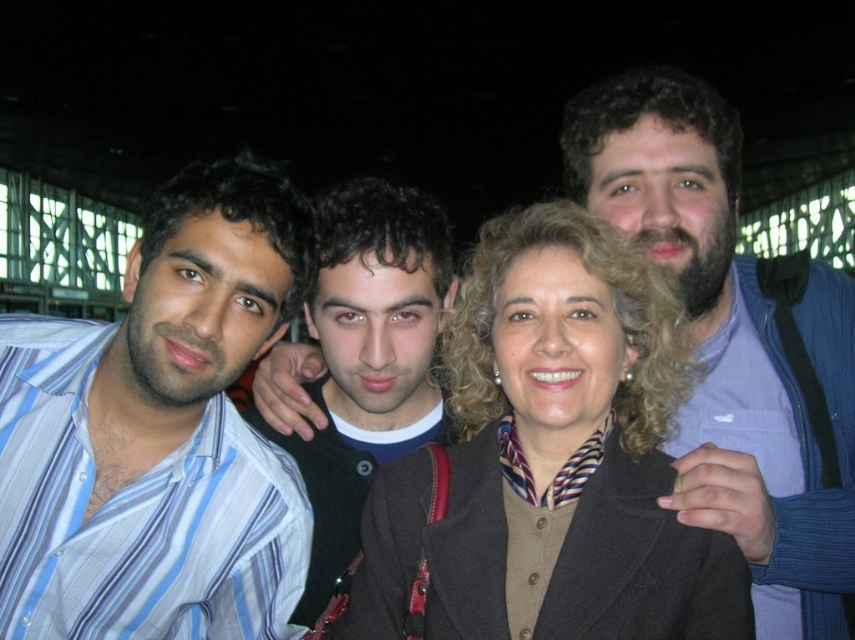
Does striped cotton shirt at left appear on the right side of bearded man at right?

Incorrect, striped cotton shirt at left is not on the right side of bearded man at right.

Is striped cotton shirt at left wider than bearded man at right?

Indeed, striped cotton shirt at left has a greater width compared to bearded man at right.

Describe the element at coordinates (158, 433) in the screenshot. This screenshot has height=640, width=855. I see `striped cotton shirt at left` at that location.

I want to click on striped cotton shirt at left, so click(158, 433).

Does dark brown woolen coat at center have a greater width compared to bearded man at right?

Indeed, dark brown woolen coat at center has a greater width compared to bearded man at right.

Which is more to the left, dark brown woolen coat at center or bearded man at right?

dark brown woolen coat at center is more to the left.

Locate an element on the screen. dark brown woolen coat at center is located at coordinates (549, 461).

At what (x,y) coordinates should I click in order to perform the action: click on dark brown woolen coat at center. Please return your answer as a coordinate pair (x, y). The height and width of the screenshot is (640, 855). Looking at the image, I should click on (549, 461).

Is dark brown woolen coat at center positioned behind striped cotton shirt at left?

No, it is not.

Can you confirm if dark brown woolen coat at center is positioned below striped cotton shirt at left?

Yes, dark brown woolen coat at center is below striped cotton shirt at left.

Between point (381, 472) and point (96, 333), which one is positioned behind?

Positioned behind is point (96, 333).

Image resolution: width=855 pixels, height=640 pixels. Identify the location of dark brown woolen coat at center. pyautogui.click(x=549, y=461).